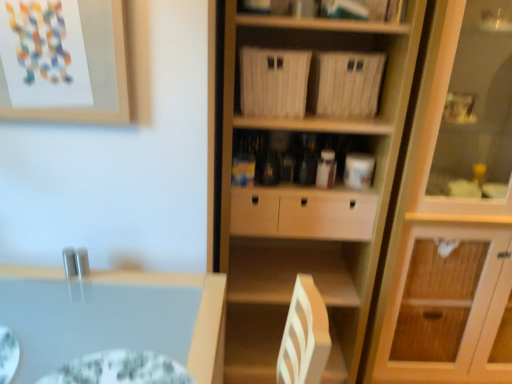
Question: From a real-world perspective, is green textured glass plate at lower left above or below light wood cabinet at right?

Choices:
 (A) above
 (B) below

Answer: (B)

Question: Based on their sizes in the image, would you say green textured glass plate at lower left is bigger or smaller than light wood cabinet at right?

Choices:
 (A) small
 (B) big

Answer: (A)

Question: Which of these objects is positioned farthest from the matte paper picture frame at upper left?

Choices:
 (A) light wood cabinet at right
 (B) green textured glass plate at lower left
 (C) wooden cupboard at center

Answer: (A)

Question: Which object is positioned closest to the green textured glass plate at lower left?

Choices:
 (A) matte paper picture frame at upper left
 (B) light wood cabinet at right
 (C) wooden cupboard at center

Answer: (A)